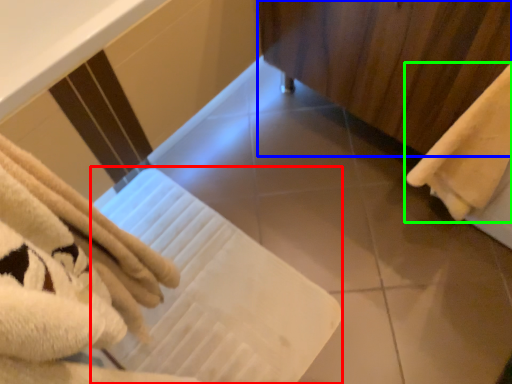
Question: Which is nearer to the bath towel (highlighted by a red box)? curtain (highlighted by a blue box) or towel (highlighted by a green box).

Choices:
 (A) curtain
 (B) towel

Answer: (B)